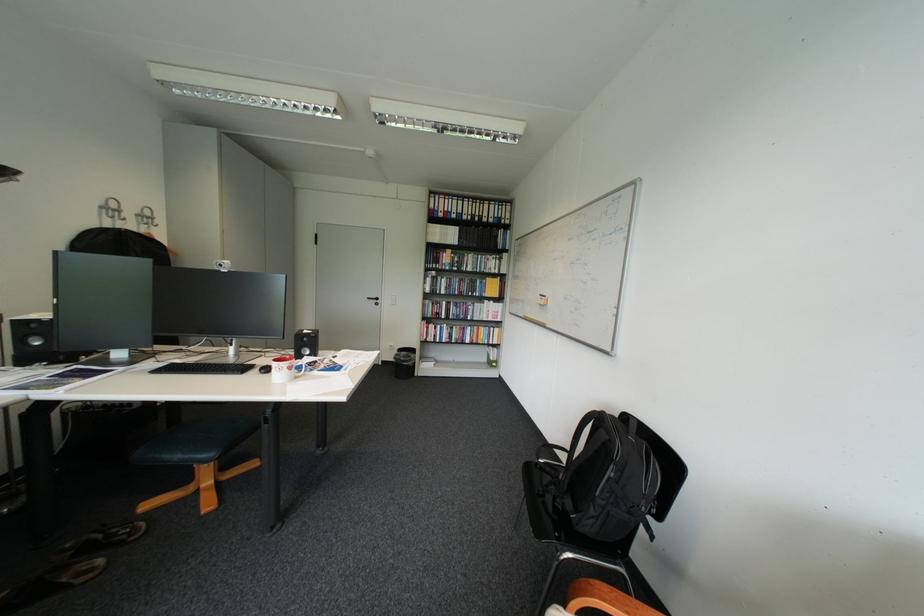
Describe the element at coordinates (550, 503) in the screenshot. The image size is (924, 616). I see `a black chair sitting surface` at that location.